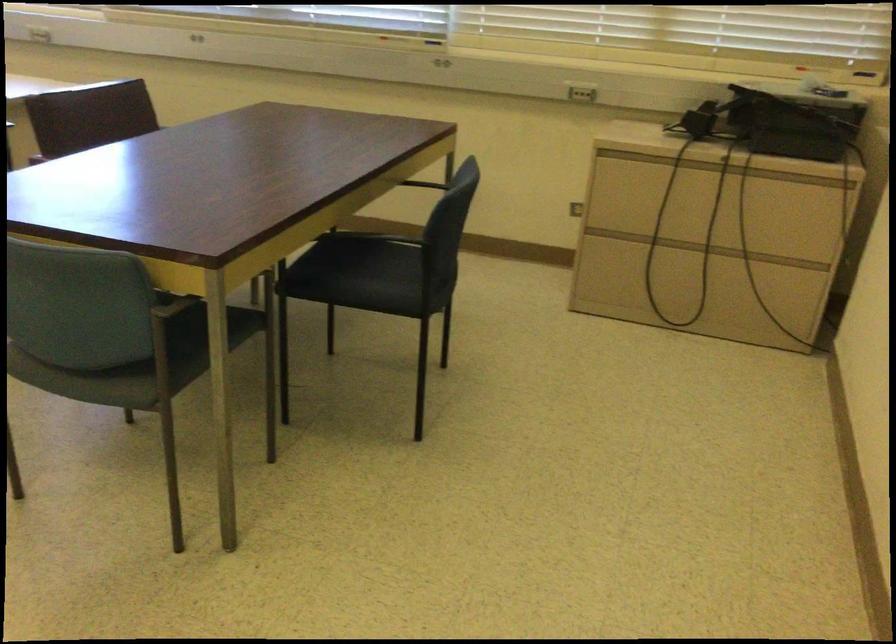
Find where to sit the green chair sitting surface. Please return your answer as a coordinate pair (x, y).

(173, 359)